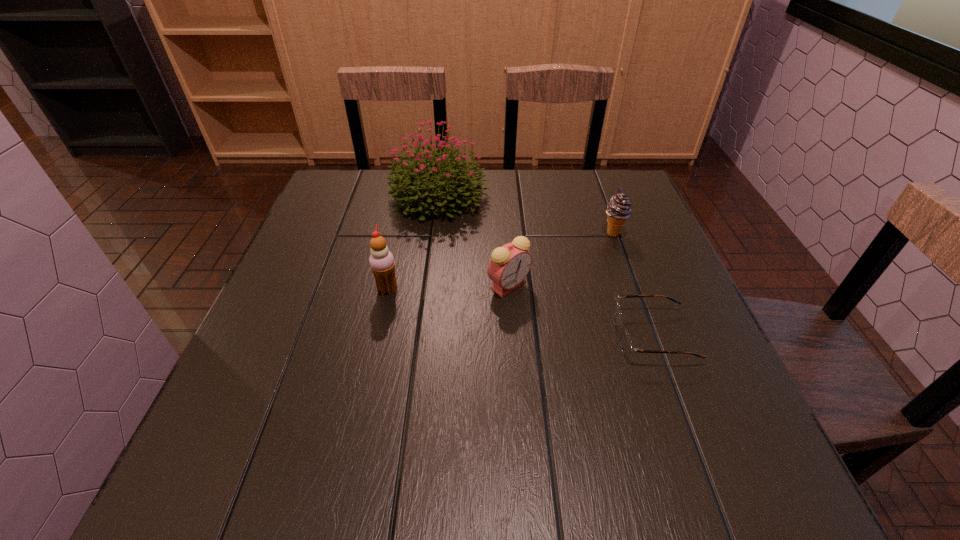
Identify the location of vacant area that lies between the farther icecream and the alarm clock. The image size is (960, 540). (561, 259).

Where is `free space that is in between the farthest object and the shorter icecream`? The height and width of the screenshot is (540, 960). free space that is in between the farthest object and the shorter icecream is located at coordinates (526, 214).

This screenshot has width=960, height=540. Find the location of `free space between the bouquet and the shortest object`. free space between the bouquet and the shortest object is located at coordinates (546, 266).

I want to click on vacant space that's between the alarm clock and the spectacles, so click(581, 310).

At what (x,y) coordinates should I click in order to perform the action: click on the closest object to the alarm clock. Please return your answer as a coordinate pair (x, y). Looking at the image, I should click on (627, 347).

I want to click on object identified as the closest to the nearest object, so click(509, 265).

You are a GUI agent. You are given a task and a screenshot of the screen. Output one action in this format:
    pyautogui.click(x=<x>, y=<y>)
    Task: Click on the vacant area in the image that satisfies the following two spatial constraints: 1. on the front side of the right icecream; 2. on the right side of the farthest object
    The height and width of the screenshot is (540, 960).
    Given the screenshot: What is the action you would take?
    click(435, 233)